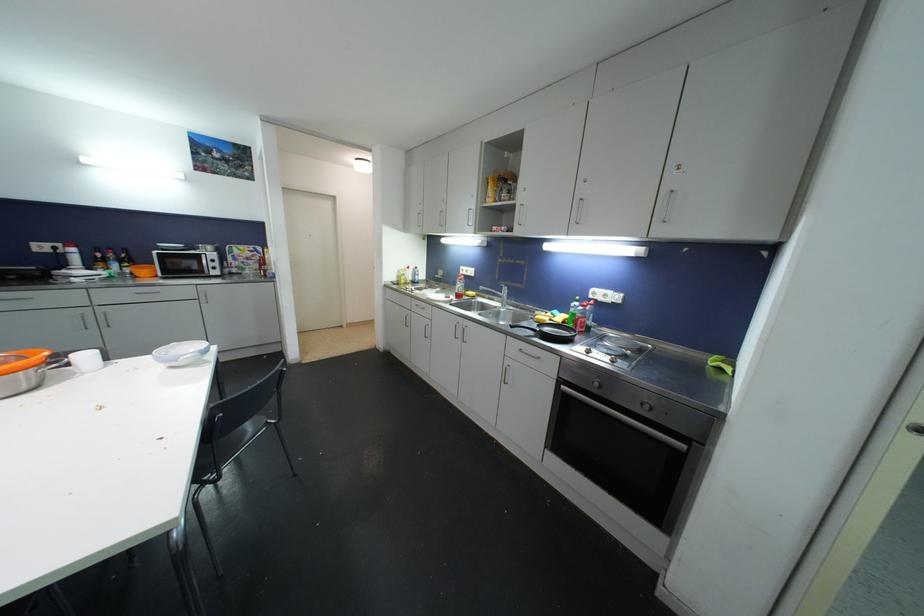
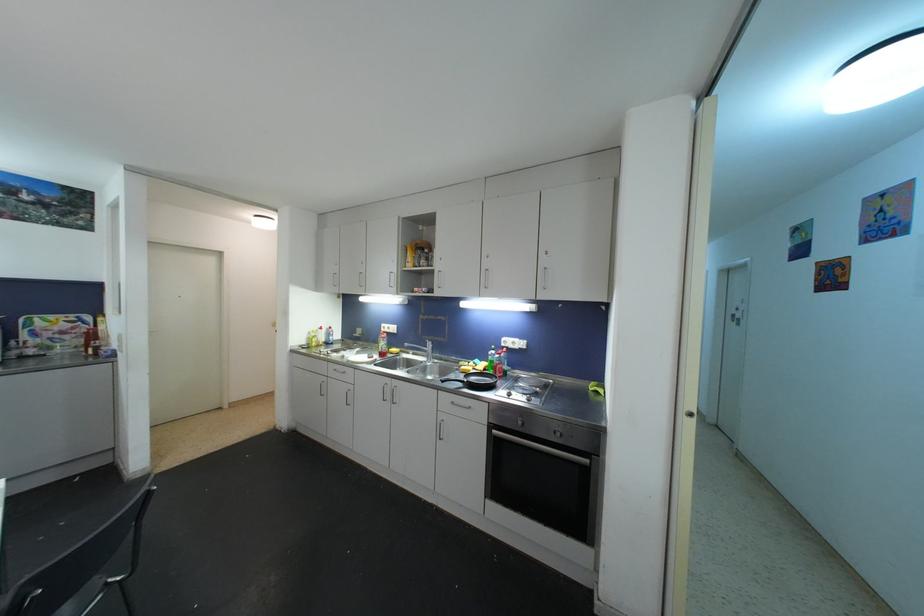
In a continuous first-person perspective shot, in which direction is the camera moving?

The movement direction of the cameraman is left, backward.